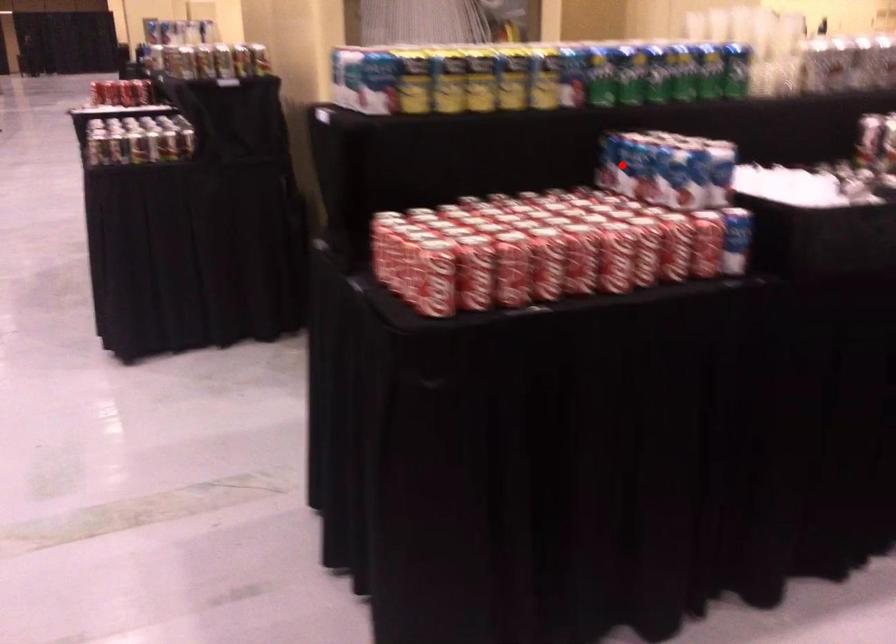
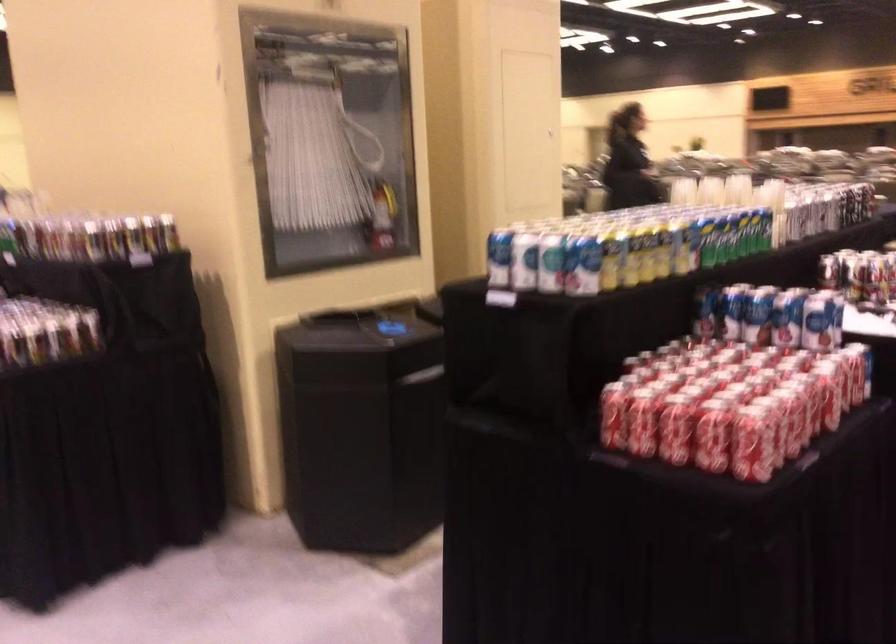
Question: I am providing you with two images of the same scene from different viewpoints. A red point is marked on the first image. At the location where the point appears in image 1, is it still visible in image 2?

Choices:
 (A) Yes
 (B) No

Answer: (A)